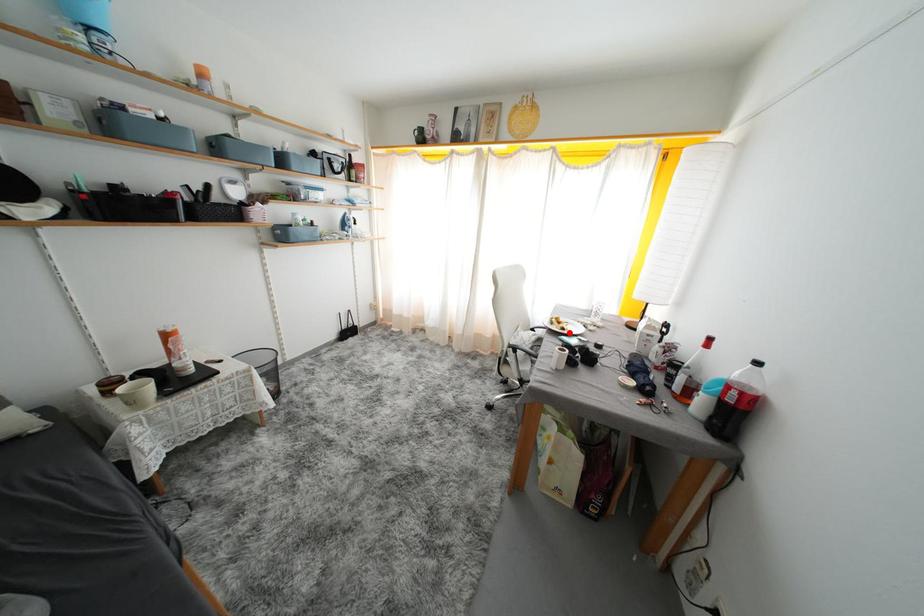
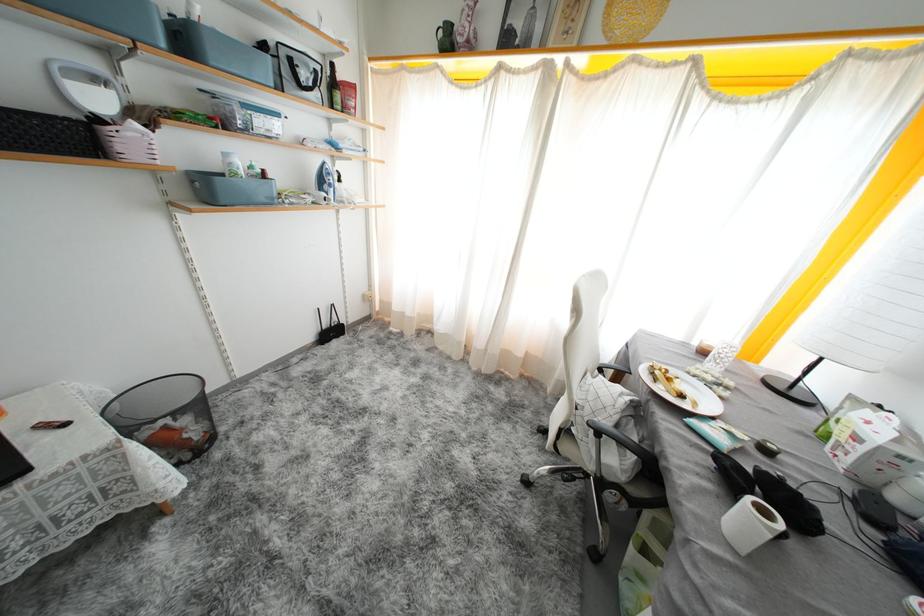
Where in the second image is the point corresponding to the highlighted location from the first image?

(687, 400)